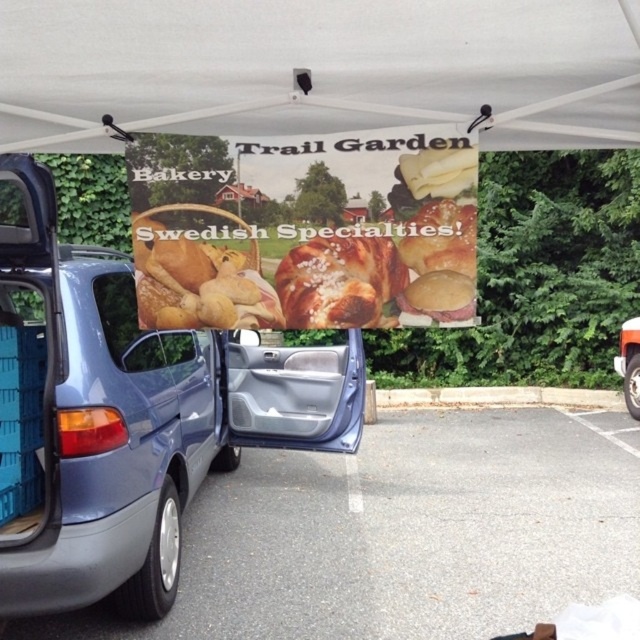
Consider the image. Can you confirm if golden crusty bread at center is shorter than yellow cheese at upper center?

In fact, golden crusty bread at center may be taller than yellow cheese at upper center.

Is golden crusty bread at center to the right of yellow cheese at upper center from the viewer's perspective?

Incorrect, golden crusty bread at center is not on the right side of yellow cheese at upper center.

At what (x,y) coordinates should I click in order to perform the action: click on golden crusty bread at center. Please return your answer as a coordinate pair (x, y). Looking at the image, I should click on (339, 280).

Can you confirm if breadcrustyatcenter is bigger than golden crusty bread at center?

Correct, breadcrustyatcenter is larger in size than golden crusty bread at center.

Based on the photo, is breadcrustyatcenter behind golden crusty bread at center?

Yes, breadcrustyatcenter is behind golden crusty bread at center.

Locate an element on the screen. Image resolution: width=640 pixels, height=640 pixels. breadcrustyatcenter is located at coordinates (198, 276).

Find the location of `breadcrustyatcenter`. breadcrustyatcenter is located at coordinates (198, 276).

Between metallic blue minivan at center and brown matte bun at center, which one is positioned higher?

Positioned higher is brown matte bun at center.

Who is more forward, (170, 600) or (452, 272)?

Point (452, 272) is in front.

The height and width of the screenshot is (640, 640). I want to click on metallic blue minivan at center, so click(125, 413).